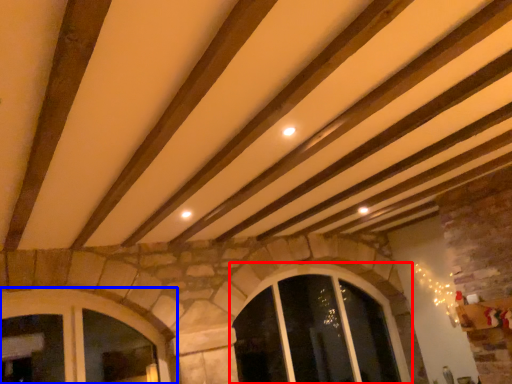
Question: Which object is further to the camera taking this photo, window (highlighted by a red box) or window (highlighted by a blue box)?

Choices:
 (A) window
 (B) window

Answer: (A)